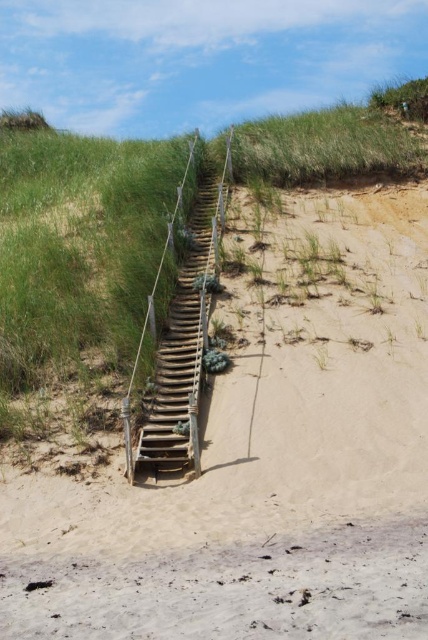
You are a hiker trying to reach the top of the dune. You see the light brown sandy stairs at center and the wooden stairs at center. Which path should you take to get to the top?

You should take the wooden stairs at center because the light brown sandy stairs at center are in front of them, blocking the path to the top.

You are planning to climb up the light brown sandy stairs at center and the wooden stairs at center. Which staircase would require more physical effort due to its height?

The light brown sandy stairs at center requires more physical effort because it has a greater height compared to the wooden stairs at center.

Looking at this image, you are a park ranger inspecting the dune area. You notice two sets of stairs leading up the dune. The first is the light brown sandy stairs at center, and the second is the wooden stairs at center. Which set of stairs do you think covers a greater area?

The light brown sandy stairs at center is larger in size than wooden stairs at center, so the light brown sandy stairs at center covers a greater area.